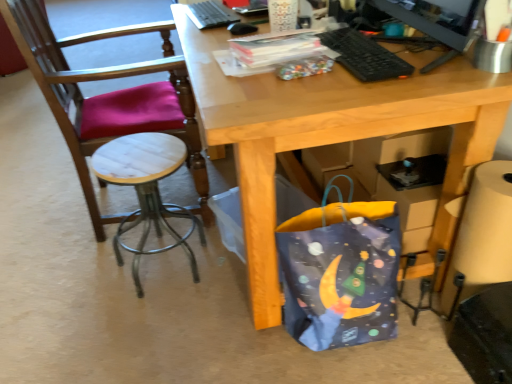
The height and width of the screenshot is (384, 512). Identify the location of vacant area situated below white marble stool at left (from a real-world perspective). (164, 268).